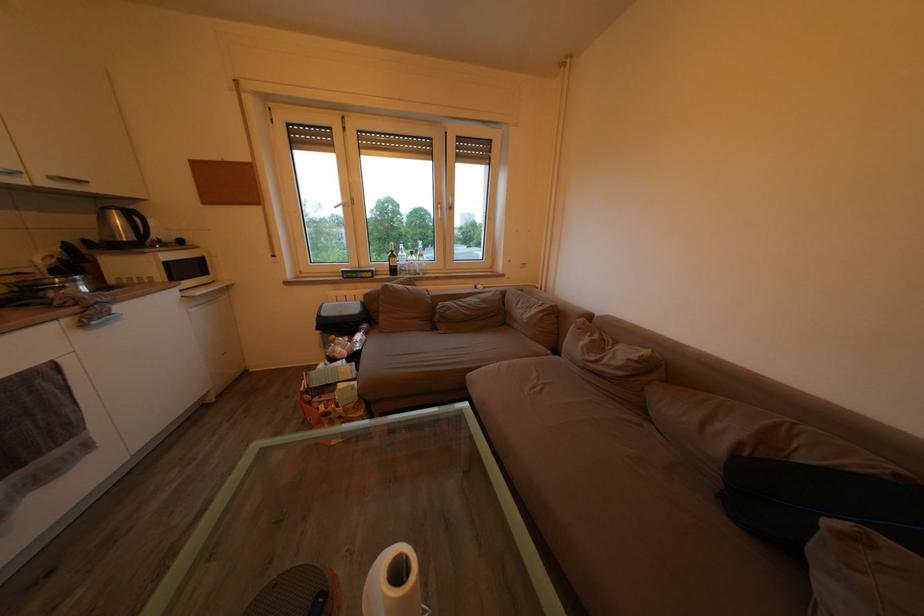
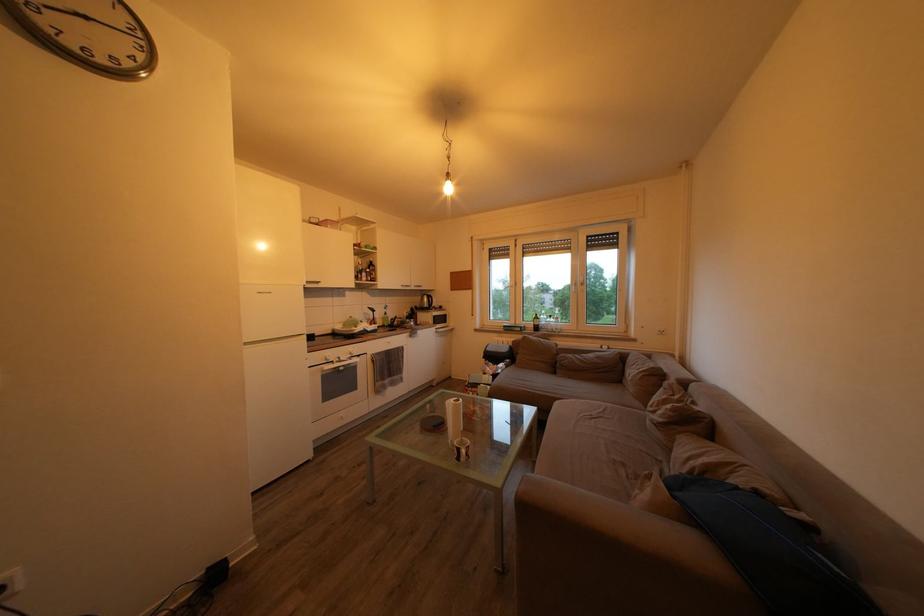
The point at (813, 463) is marked in the first image. Where is the corresponding point in the second image?

(736, 488)